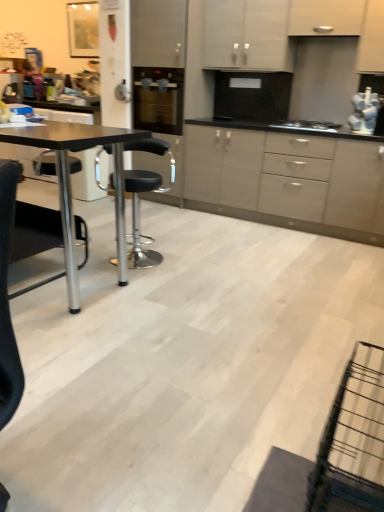
Question: Considering the relative sizes of black matte table at left and black leather stool at center in the image provided, is black matte table at left shorter than black leather stool at center?

Choices:
 (A) yes
 (B) no

Answer: (B)

Question: From the image's perspective, does black matte table at left appear lower than black leather stool at center?

Choices:
 (A) no
 (B) yes

Answer: (B)

Question: Does black matte table at left appear on the left side of black leather stool at center?

Choices:
 (A) yes
 (B) no

Answer: (A)

Question: Does black matte table at left touch black leather stool at center?

Choices:
 (A) yes
 (B) no

Answer: (B)

Question: Is black matte table at left thinner than black leather stool at center?

Choices:
 (A) yes
 (B) no

Answer: (B)

Question: Is black leather stool at center bigger or smaller than white matte cabinet at upper center, which is counted as the third cabinetry, starting from the bottom?

Choices:
 (A) big
 (B) small

Answer: (A)

Question: From their relative heights in the image, would you say black leather stool at center is taller or shorter than white matte cabinet at upper center, which is counted as the first cabinetry, starting from the top?

Choices:
 (A) short
 (B) tall

Answer: (B)

Question: From a real-world perspective, relative to white matte cabinet at upper center, which is counted as the first cabinetry, starting from the top, is black leather stool at center vertically above or below?

Choices:
 (A) above
 (B) below

Answer: (B)

Question: In the image, is black leather stool at center positioned in front of or behind white matte cabinet at upper center, which is counted as the first cabinetry, starting from the top?

Choices:
 (A) behind
 (B) front

Answer: (B)

Question: Considering the positions of white matte cabinet at upper center, which is counted as the first cabinetry, starting from the top, and white matte cabinet at upper center, which is counted as the second cabinetry, starting from the bottom, in the image, is white matte cabinet at upper center, which is counted as the first cabinetry, starting from the top, taller or shorter than white matte cabinet at upper center, which is counted as the second cabinetry, starting from the bottom,?

Choices:
 (A) tall
 (B) short

Answer: (A)

Question: From the image's perspective, relative to white matte cabinet at upper center, which is the 2th cabinetry in top-to-bottom order, is white matte cabinet at upper center, which is counted as the first cabinetry, starting from the top, above or below?

Choices:
 (A) above
 (B) below

Answer: (A)

Question: Is white matte cabinet at upper center, which is counted as the first cabinetry, starting from the top, to the left or to the right of white matte cabinet at upper center, which is the 2th cabinetry in top-to-bottom order, in the image?

Choices:
 (A) left
 (B) right

Answer: (A)

Question: In the image, is white matte cabinet at upper center, which is counted as the third cabinetry, starting from the bottom, positioned in front of or behind white matte cabinet at upper center, which is counted as the second cabinetry, starting from the bottom?

Choices:
 (A) behind
 (B) front

Answer: (A)

Question: In the image, is white matte cabinet at upper center, which is counted as the third cabinetry, starting from the bottom, positioned in front of or behind black leather stool at center?

Choices:
 (A) front
 (B) behind

Answer: (B)

Question: From a real-world perspective, relative to black leather stool at center, is white matte cabinet at upper center, which is counted as the first cabinetry, starting from the top, vertically above or below?

Choices:
 (A) above
 (B) below

Answer: (A)